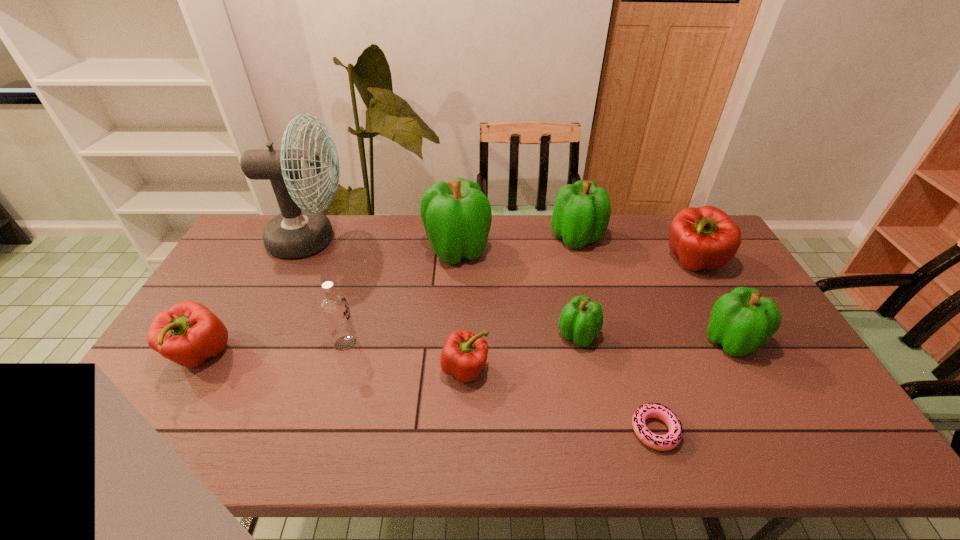
The image size is (960, 540). Find the location of `vacant space at the far edge of the desktop`. vacant space at the far edge of the desktop is located at coordinates (500, 214).

This screenshot has width=960, height=540. What are the coordinates of `vacant space at the near edge of the desktop` in the screenshot? It's located at (374, 451).

You are a GUI agent. You are given a task and a screenshot of the screen. Output one action in this format:
    pyautogui.click(x=<x>, y=<y>)
    Task: Click on the vacant area at the left edge
    The width and height of the screenshot is (960, 540).
    Given the screenshot: What is the action you would take?
    pyautogui.click(x=229, y=332)

Identify the location of vacant space that's between the tallest object and the rightmost green bell pepper. (521, 291).

Locate an element on the screen. The width and height of the screenshot is (960, 540). free space that is in between the second smallest pink bell pepper and the fan is located at coordinates [x=255, y=298].

The image size is (960, 540). In order to click on empty location between the smallest green bell pepper and the farthest pink bell pepper in this screenshot , I will do 636,299.

At what (x,y) coordinates should I click in order to perform the action: click on free space between the third object from left to right and the second pink bell pepper from left to right. Please return your answer as a coordinate pair (x, y). The image size is (960, 540). Looking at the image, I should click on (405, 356).

Locate an element on the screen. This screenshot has width=960, height=540. vacant area that lies between the biggest green bell pepper and the fan is located at coordinates (384, 245).

You are a GUI agent. You are given a task and a screenshot of the screen. Output one action in this format:
    pyautogui.click(x=<x>, y=<y>)
    Task: Click on the vacant region between the second biggest green bell pepper and the second smallest pink bell pepper
    Image resolution: width=960 pixels, height=540 pixels.
    Given the screenshot: What is the action you would take?
    pyautogui.click(x=389, y=296)

In order to click on empty space between the vodka and the leftmost bell pepper in this screenshot , I will do `click(274, 349)`.